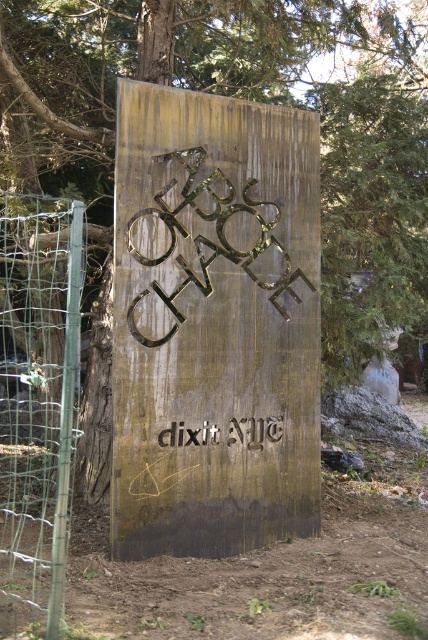
You are a hiker standing at the gold metallic sign at center and want to reach the brown dirt track at lower left. Which direction should you move to get closer to the track?

The gold metallic sign at center is further to the viewer than the brown dirt track at lower left, so you should move forward away from the sign to reach the track.